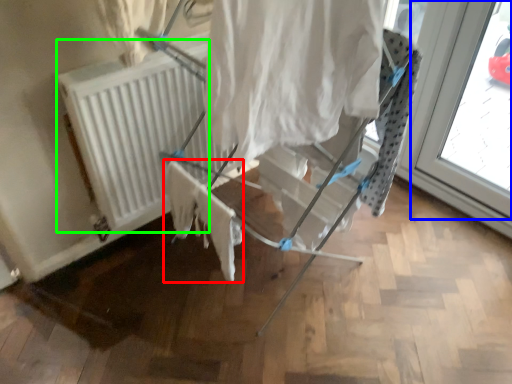
Question: Estimate the real-world distances between objects in this image. Which object is farther from fabric (highlighted by a red box), window (highlighted by a blue box) or radiator (highlighted by a green box)?

Choices:
 (A) window
 (B) radiator

Answer: (A)